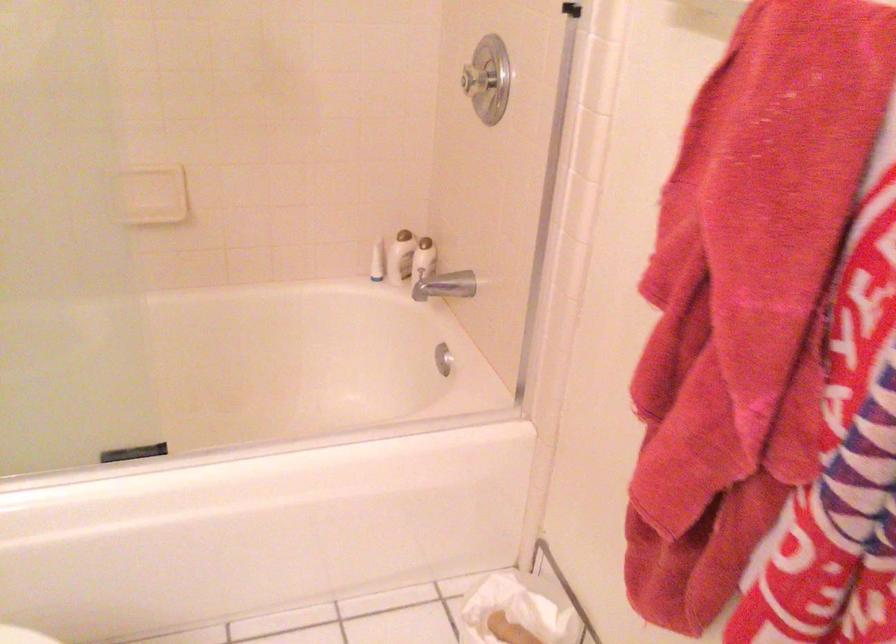
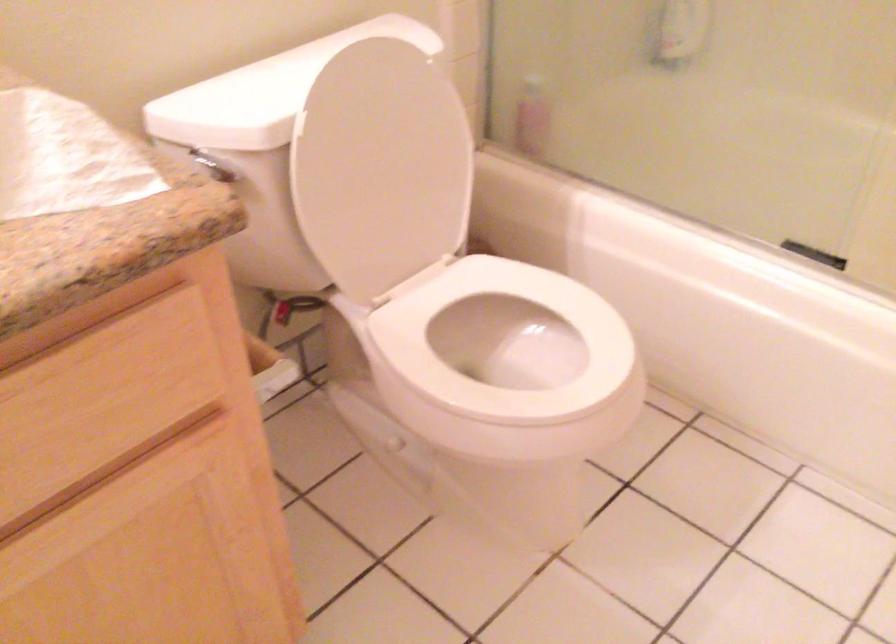
The images are taken continuously from a first-person perspective. In which direction is your viewpoint rotating?

The camera's rotation is toward left-down.